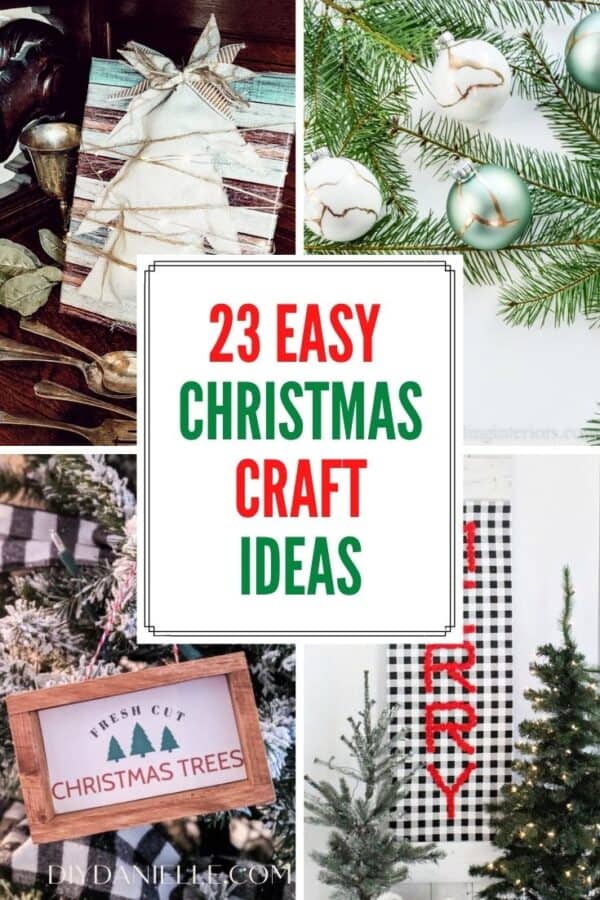
I want to click on light, so 65,559.